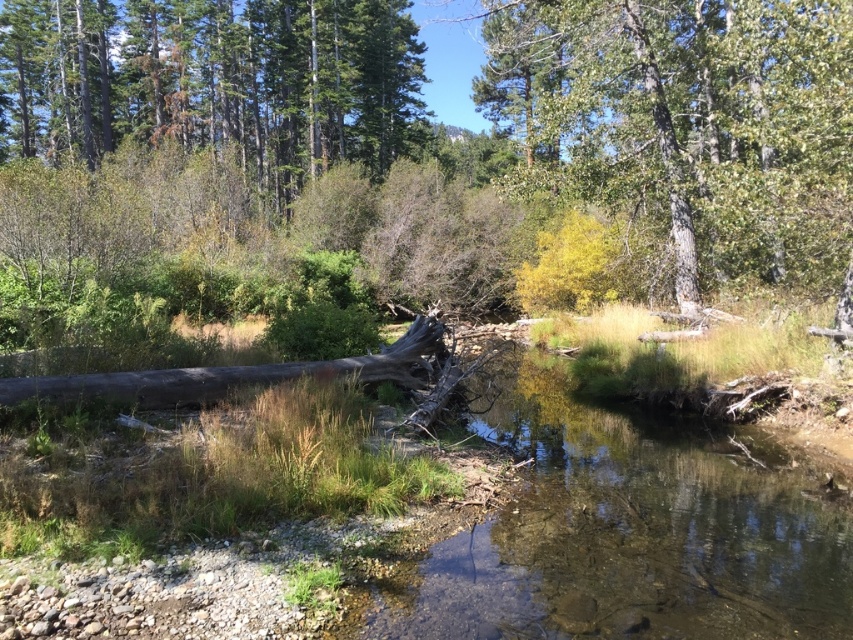
Does green leafy tree at upper center have a greater height compared to green matte tree at upper left?

A: Indeed, green leafy tree at upper center has a greater height compared to green matte tree at upper left.

Which is more to the right, green leafy tree at upper center or green matte tree at upper left?

Positioned to the right is green leafy tree at upper center.

Locate an element on the screen. green leafy tree at upper center is located at coordinates (688, 124).